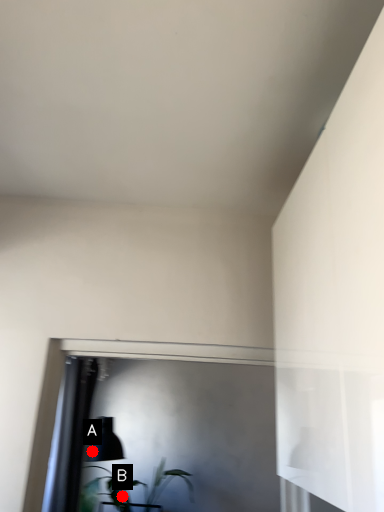
Question: Two points are circled on the image, labeled by A and B beside each circle. Which point is closer to the camera?

Choices:
 (A) A is closer
 (B) B is closer

Answer: (B)